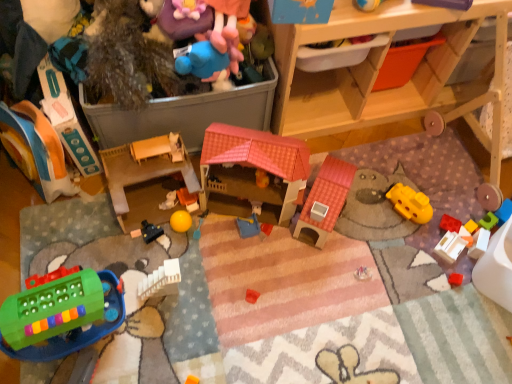
Question: Are matte plastic toy at left, which is counted as the 12th toy, starting from the right, and translucent plastic cube at center, which is counted as the 13th toy, starting from the left, beside each other?

Choices:
 (A) no
 (B) yes

Answer: (A)

Question: From a real-world perspective, does matte plastic toy at left, which is counted as the 12th toy, starting from the right, stand above translucent plastic cube at center, which is counted as the 13th toy, starting from the left?

Choices:
 (A) yes
 (B) no

Answer: (A)

Question: Does matte plastic toy at left, the second toy viewed from the left, lie behind translucent plastic cube at center, the first toy when ordered from right to left?

Choices:
 (A) no
 (B) yes

Answer: (A)

Question: Does matte plastic toy at left, which is counted as the 12th toy, starting from the right, turn towards translucent plastic cube at center, which is counted as the 13th toy, starting from the left?

Choices:
 (A) yes
 (B) no

Answer: (B)

Question: Is matte plastic toy at left, the second toy viewed from the left, taller than translucent plastic cube at center, the first toy when ordered from right to left?

Choices:
 (A) yes
 (B) no

Answer: (A)

Question: From the image's perspective, is matte plastic toy at left, which is counted as the 12th toy, starting from the right, beneath translucent plastic cube at center, which is counted as the 13th toy, starting from the left?

Choices:
 (A) no
 (B) yes

Answer: (A)

Question: Would you say translucent orange cube at center, which ranks as the eleventh toy in left-to-right order, is outside blue plush toy at upper center, which is the eighth toy in left-to-right order?

Choices:
 (A) no
 (B) yes

Answer: (B)

Question: Is translucent orange cube at center, the 3th toy in the right-to-left sequence, smaller than blue plush toy at upper center, which is the eighth toy in left-to-right order?

Choices:
 (A) yes
 (B) no

Answer: (A)

Question: From the image's perspective, is translucent orange cube at center, the 3th toy in the right-to-left sequence, located above blue plush toy at upper center, which is the eighth toy in left-to-right order?

Choices:
 (A) no
 (B) yes

Answer: (A)

Question: Is the position of translucent orange cube at center, which ranks as the eleventh toy in left-to-right order, less distant than that of blue plush toy at upper center, the sixth toy positioned from the right?

Choices:
 (A) no
 (B) yes

Answer: (A)

Question: Does translucent orange cube at center, which ranks as the eleventh toy in left-to-right order, have a lesser width compared to blue plush toy at upper center, which is the eighth toy in left-to-right order?

Choices:
 (A) no
 (B) yes

Answer: (B)

Question: Is translucent orange cube at center, the 3th toy in the right-to-left sequence, touching blue plush toy at upper center, the sixth toy positioned from the right?

Choices:
 (A) yes
 (B) no

Answer: (B)

Question: From a real-world perspective, is white plastic toy at lower right, positioned as the 4th toy in right-to-left order, under blue plush toy at upper center, which is the eighth toy in left-to-right order?

Choices:
 (A) yes
 (B) no

Answer: (A)